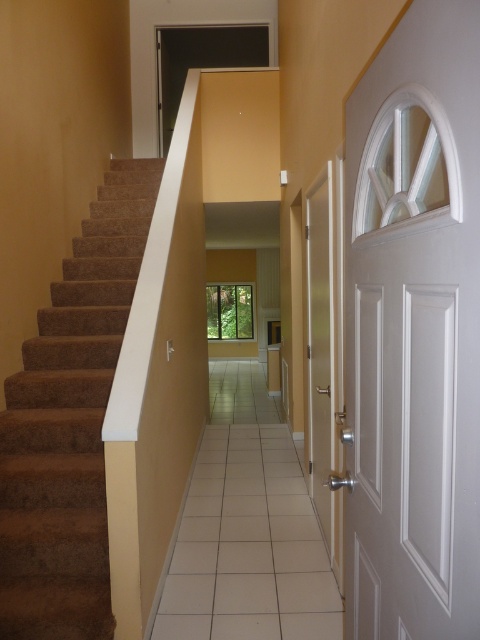
You are standing at the entrance of the hallway and want to reach the white glossy door at center. Is the brown carpeted stairs at left blocking your path? Please explain based on their positions.

The brown carpeted stairs at left is closer to the viewer than the white glossy door at center, so the stairs are in front of the door. This means the brown carpeted stairs at left are blocking the path to the white glossy door at center.

You are moving a large painting that is 1.2 meters wide. You need to pass through the hallway and decide whether the space between the brown carpeted stairs at left and the white glossy door at center is wide enough. Can you fit through?

The brown carpeted stairs at left is bigger than the white glossy door at center, but the exact width of the hallway isn